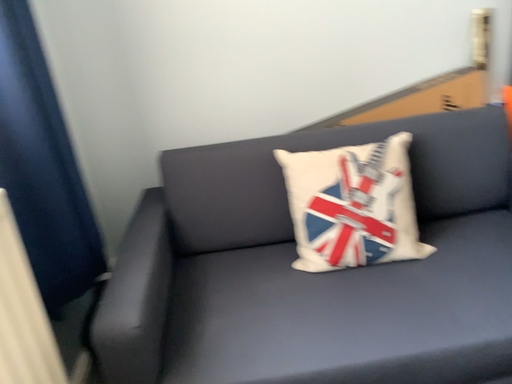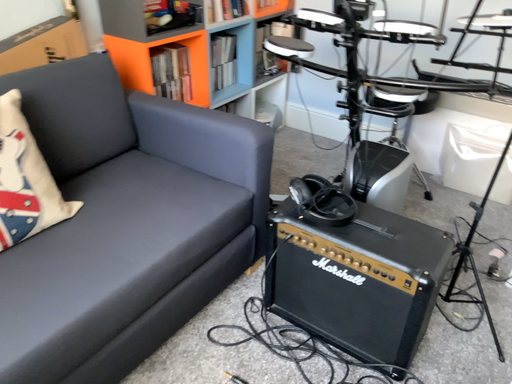
Question: How did the camera likely rotate when shooting the video?

Choices:
 (A) rotated right
 (B) rotated left

Answer: (A)